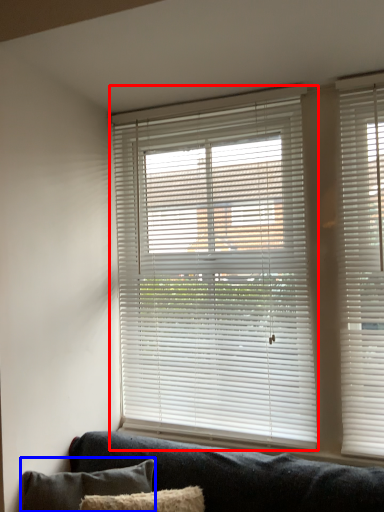
Question: Among these objects, which one is farthest to the camera, window blind (highlighted by a red box) or pillow (highlighted by a blue box)?

Choices:
 (A) window blind
 (B) pillow

Answer: (A)